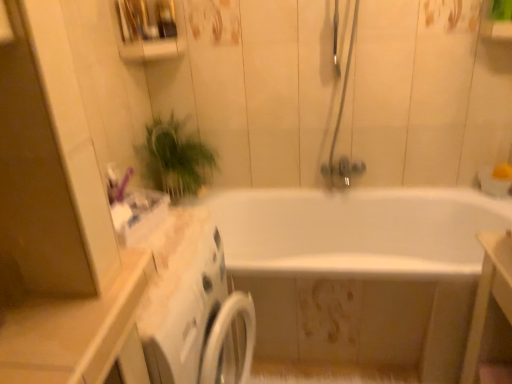
Question: Does matte silver shower door at upper center have a lesser width compared to white glossy vanity at lower right?

Choices:
 (A) no
 (B) yes

Answer: (B)

Question: Is matte silver shower door at upper center taller than white glossy vanity at lower right?

Choices:
 (A) yes
 (B) no

Answer: (A)

Question: Is matte silver shower door at upper center positioned before white glossy vanity at lower right?

Choices:
 (A) yes
 (B) no

Answer: (B)

Question: Considering the relative sizes of matte silver shower door at upper center and white glossy vanity at lower right in the image provided, is matte silver shower door at upper center wider than white glossy vanity at lower right?

Choices:
 (A) yes
 (B) no

Answer: (B)

Question: Can you confirm if matte silver shower door at upper center is shorter than white glossy vanity at lower right?

Choices:
 (A) yes
 (B) no

Answer: (B)

Question: Is green leafy plant at upper left in front of or behind matte silver shower door at upper center in the image?

Choices:
 (A) behind
 (B) front

Answer: (A)

Question: From a real-world perspective, is green leafy plant at upper left positioned above or below matte silver shower door at upper center?

Choices:
 (A) below
 (B) above

Answer: (A)

Question: Is point (158, 170) positioned closer to the camera than point (343, 178)?

Choices:
 (A) farther
 (B) closer

Answer: (A)

Question: From the image's perspective, relative to matte silver shower door at upper center, is green leafy plant at upper left above or below?

Choices:
 (A) below
 (B) above

Answer: (A)

Question: In terms of height, does matte silver shower door at upper center look taller or shorter compared to green leafy plant at upper left?

Choices:
 (A) short
 (B) tall

Answer: (B)

Question: Considering their positions, is matte silver shower door at upper center located in front of or behind green leafy plant at upper left?

Choices:
 (A) front
 (B) behind

Answer: (A)

Question: Is point (361, 172) positioned closer to the camera than point (169, 165)?

Choices:
 (A) closer
 (B) farther

Answer: (B)

Question: Based on their sizes in the image, would you say matte silver shower door at upper center is bigger or smaller than green leafy plant at upper left?

Choices:
 (A) big
 (B) small

Answer: (B)

Question: Would you say white glossy bathtub at center is to the left or to the right of white glossy vanity at lower right in the picture?

Choices:
 (A) left
 (B) right

Answer: (A)

Question: From a real-world perspective, is white glossy bathtub at center above or below white glossy vanity at lower right?

Choices:
 (A) below
 (B) above

Answer: (A)